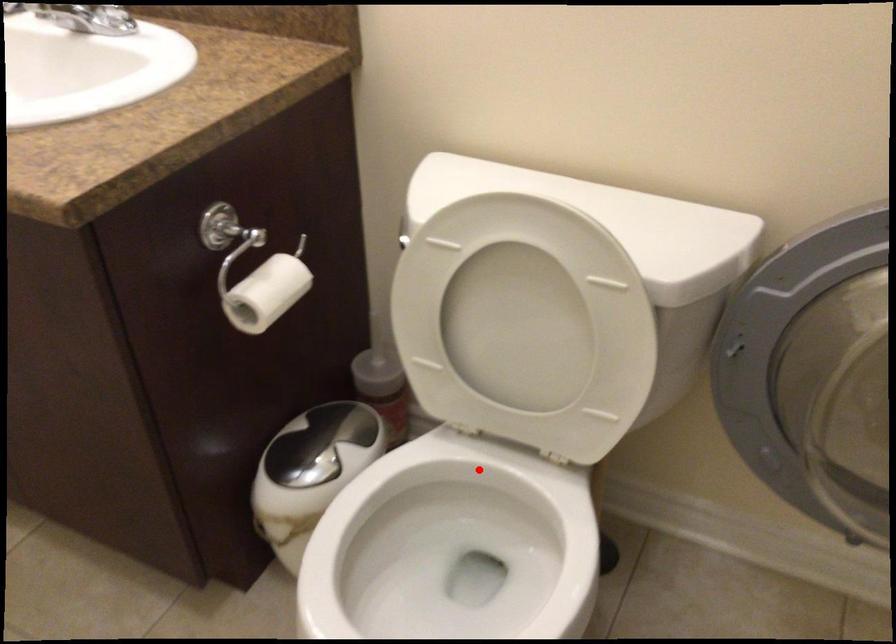
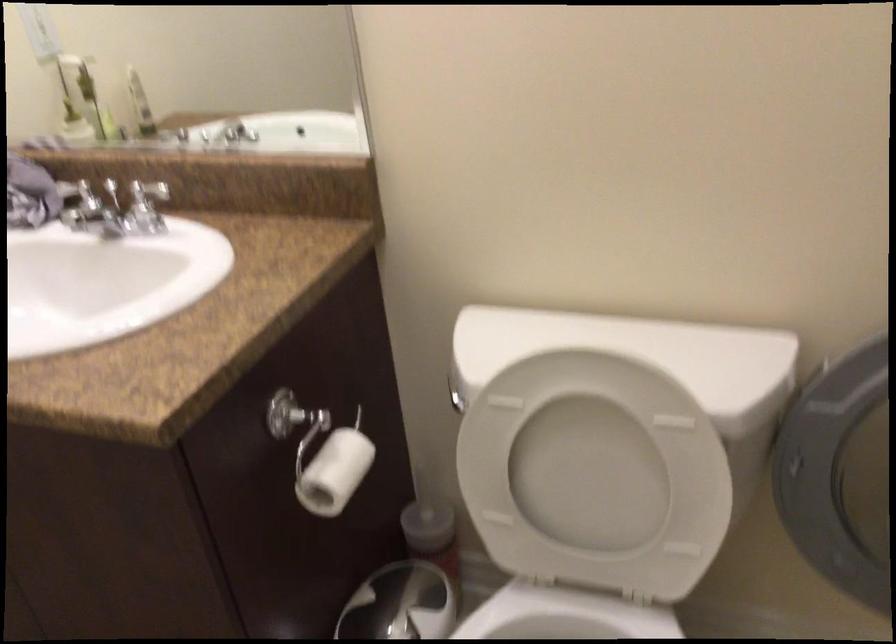
Find the pixel in the second image that matches the highlighted location in the first image.

(564, 616)